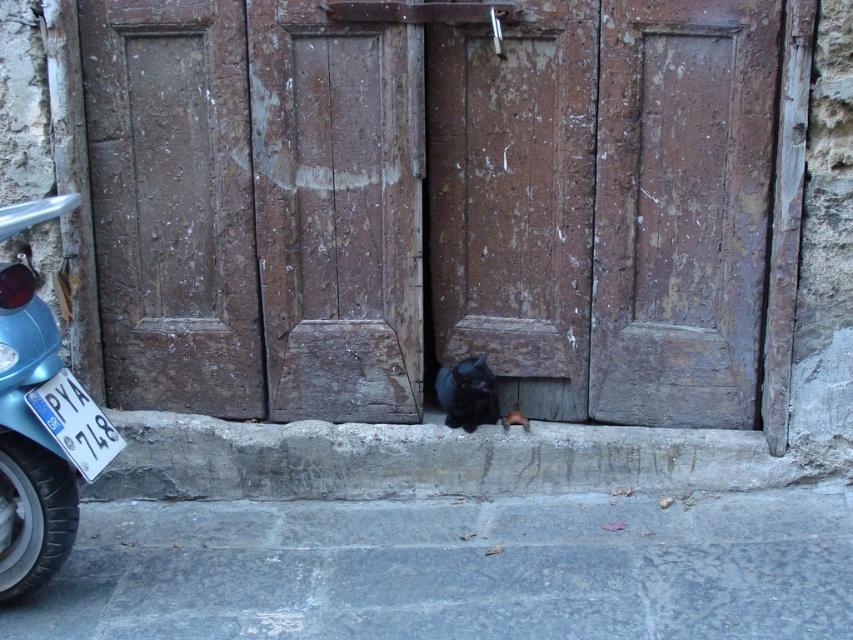
Which of these two, gray concrete curb at lower center or black fur cat at center, stands shorter?

black fur cat at center is shorter.

Is gray concrete curb at lower center shorter than black fur cat at center?

In fact, gray concrete curb at lower center may be taller than black fur cat at center.

Is point (717, 433) closer to viewer compared to point (486, 394)?

Yes, it is.

The image size is (853, 640). In order to click on gray concrete curb at lower center in this screenshot , I will do `click(444, 460)`.

Between rusty wood door at center and gray concrete curb at lower center, which one appears on the left side from the viewer's perspective?

rusty wood door at center is more to the left.

I want to click on rusty wood door at center, so click(434, 204).

Can you confirm if rusty wood door at center is taller than blue glossy motorcycle at left?

Indeed, rusty wood door at center has a greater height compared to blue glossy motorcycle at left.

Can you confirm if rusty wood door at center is positioned to the left of blue glossy motorcycle at left?

Incorrect, rusty wood door at center is not on the left side of blue glossy motorcycle at left.

Which is in front, point (550, 262) or point (41, 432)?

Positioned in front is point (41, 432).

Image resolution: width=853 pixels, height=640 pixels. I want to click on rusty wood door at center, so click(x=434, y=204).